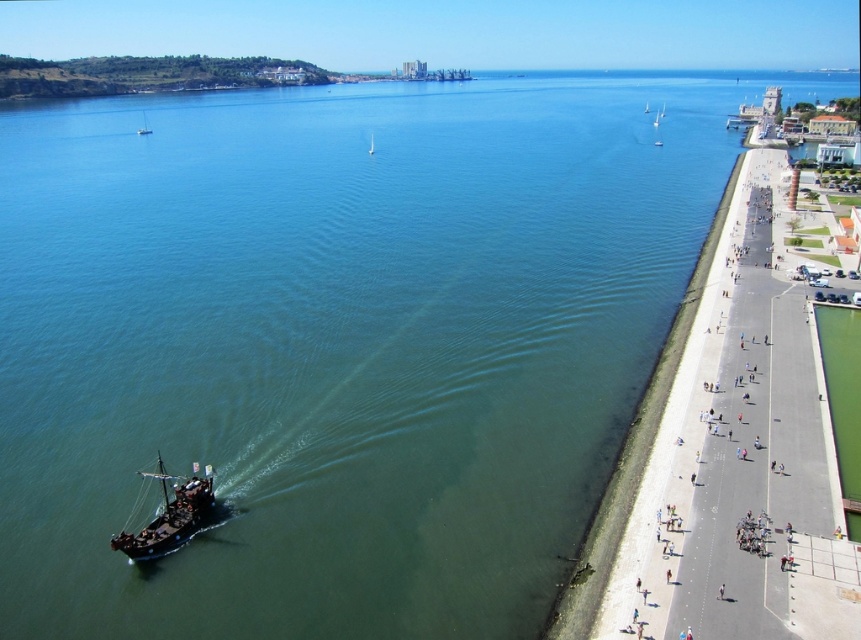
Based on the photo, you are standing on the promenade and want to take a photo of both the wooden sailboat at upper center and the white glossy sailboat at center in the same frame. Given that your camera has a 50mm lens which has a field of view that can capture objects up to 100 meters apart, will you be able to include both boats in your photo?

The wooden sailboat at upper center is 123.94 meters away from the white glossy sailboat at center. Since the maximum distance your camera can capture in one frame is 100 meters, you won photography the two boats together because the distance between them exceeds the lens field of view.

You are standing at the point with coordinates (144, 125) in the coastal scene. What object is located exactly at your current position?

The wooden sailboat at upper center is located exactly at the point with coordinates (144, 125).

You are standing at the camera position and want to take a photo of the wooden ship at lower left. If your camera has a maximum zoom range of 50 meters, will you be able to capture the ship clearly?

The wooden ship at lower left and camera are 53.44 meters apart from each other, which exceeds the camera maximum zoom range of 50 meters. Therefore, you won not be able to capture the ship clearly.